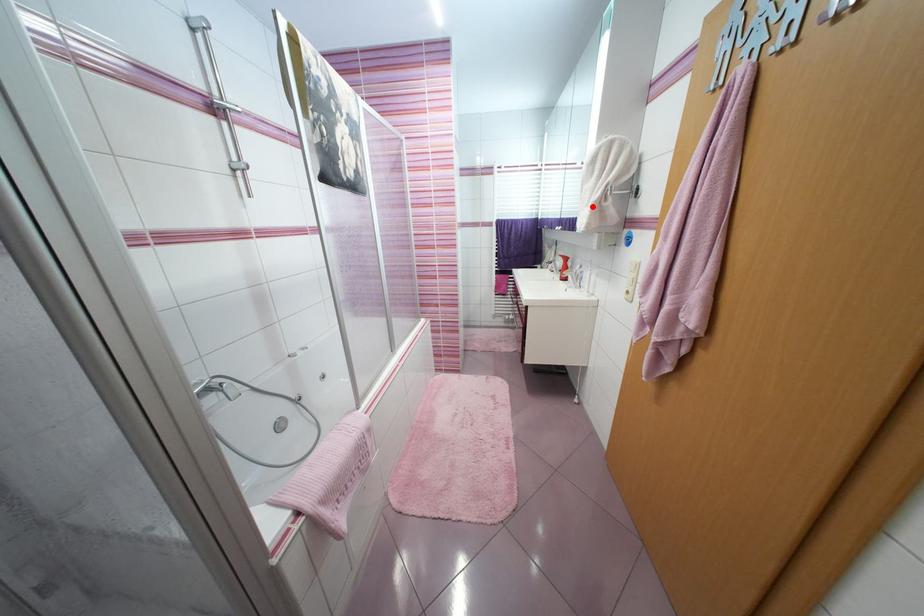
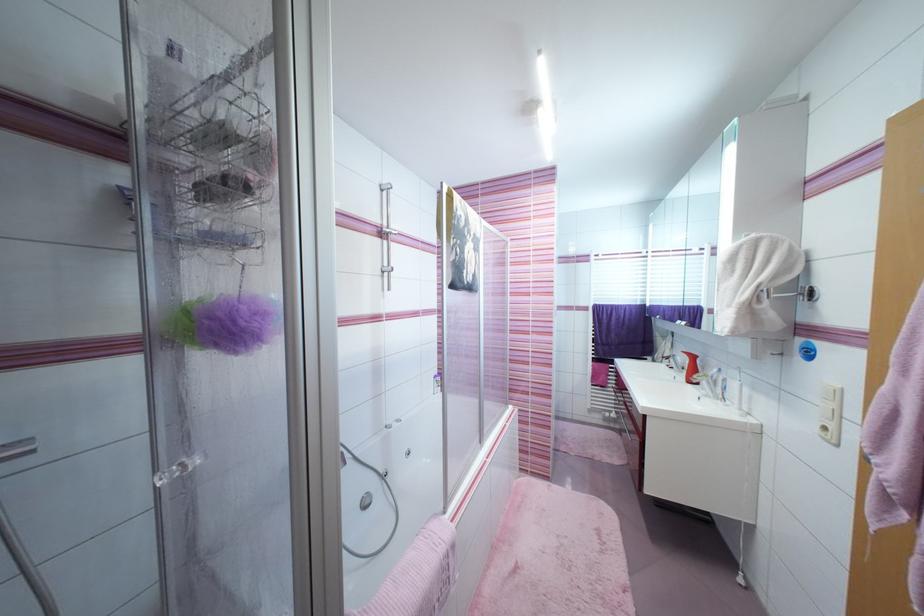
Where in the second image is the point corresponding to the highlighted location from the first image?

(735, 307)